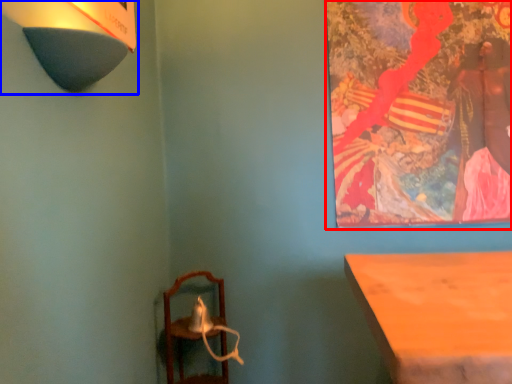
Question: Which object appears farthest to the camera in this image, picture frame (highlighted by a red box) or lamp (highlighted by a blue box)?

Choices:
 (A) picture frame
 (B) lamp

Answer: (A)